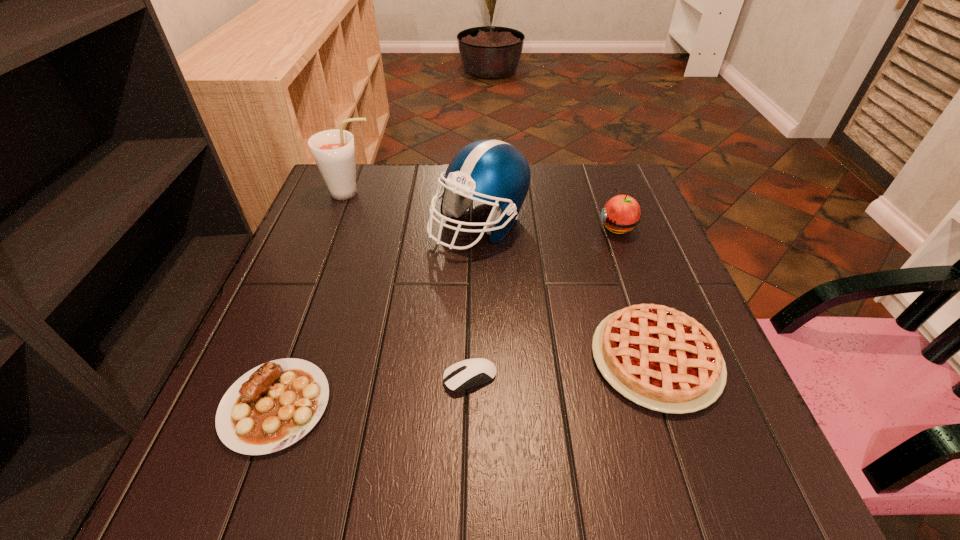
I want to click on vacant region located on the back of the steak, so click(321, 282).

The height and width of the screenshot is (540, 960). I want to click on vacant space located on the back of the mouse, so click(x=472, y=273).

What are the coordinates of `football helmet located at the far edge` in the screenshot? It's located at (493, 172).

Where is `root beer located at the far edge`? The height and width of the screenshot is (540, 960). root beer located at the far edge is located at coordinates (333, 150).

Identify the location of object that is positioned at the near edge. The width and height of the screenshot is (960, 540). (274, 405).

The height and width of the screenshot is (540, 960). I want to click on root beer situated at the left edge, so click(333, 150).

You are a GUI agent. You are given a task and a screenshot of the screen. Output one action in this format:
    pyautogui.click(x=<x>, y=<y>)
    Task: Click on the steak that is at the left edge
    The width and height of the screenshot is (960, 540).
    Given the screenshot: What is the action you would take?
    pyautogui.click(x=274, y=405)

Locate an element on the screen. Image resolution: width=960 pixels, height=540 pixels. apple that is positioned at the right edge is located at coordinates (622, 213).

You are a GUI agent. You are given a task and a screenshot of the screen. Output one action in this format:
    pyautogui.click(x=<x>, y=<y>)
    Task: Click on the pie that is at the right edge
    The width and height of the screenshot is (960, 540).
    Given the screenshot: What is the action you would take?
    pyautogui.click(x=658, y=357)

In order to click on object that is at the far left corner in this screenshot , I will do `click(333, 150)`.